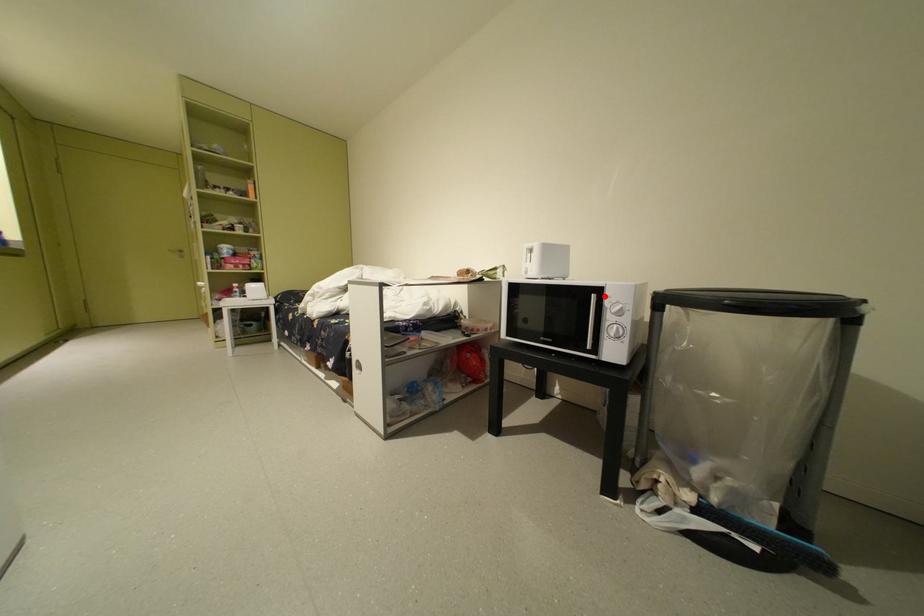
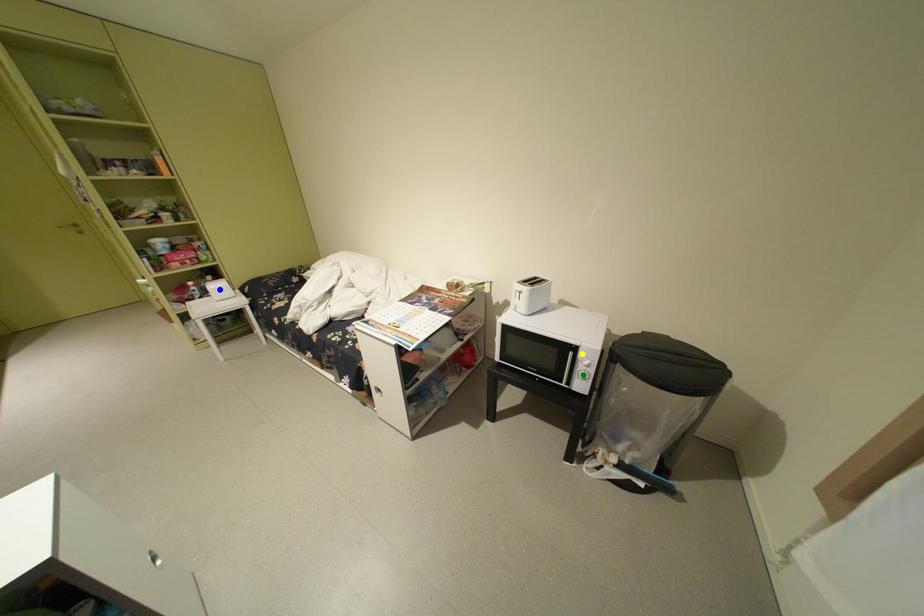
Question: I am providing you with two images of the same scene from different viewpoints. A red point is marked on the first image. You are given multiple points on the second image. Which point in image 2 is actually the same real-world point as the red point in image 1?

Choices:
 (A) yellow point
 (B) green point
 (C) blue point

Answer: (A)